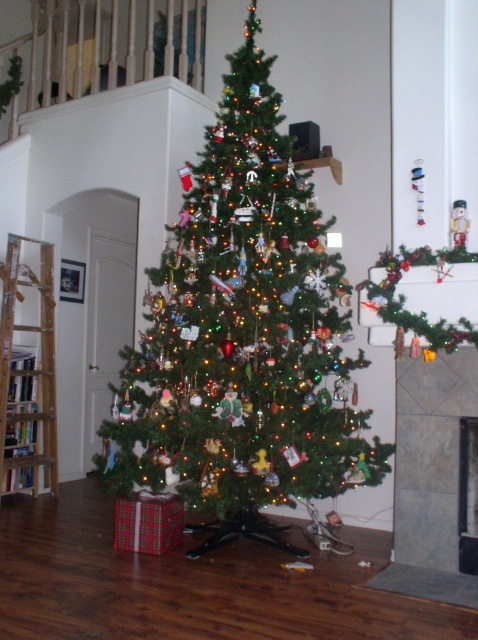
Based on the photo, you are planning to hang a small Christmas ornament on the gray tile fireplace at lower right and the white marble fireplace at center. Based on their heights, which fireplace would allow you to place the ornament higher up without it being too low to the ground?

The gray tile fireplace at lower right is much taller than the white marble fireplace at center, so you can place the ornament higher up on the gray tile fireplace at lower right without it being too low to the ground.

What are the coordinates of the green matte christmas tree at center in the image?

The green matte christmas tree at center is located at coordinates point (242,330).